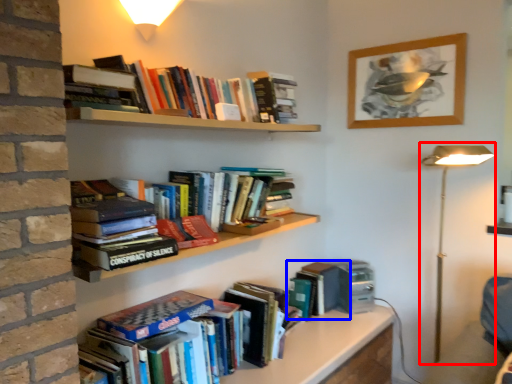
Question: Among these objects, which one is farthest to the camera, table lamp (highlighted by a red box) or book (highlighted by a blue box)?

Choices:
 (A) table lamp
 (B) book

Answer: (B)